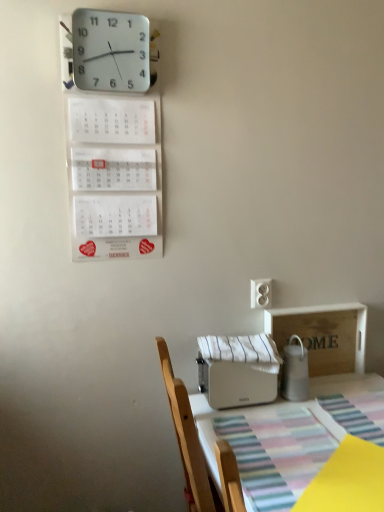
Where is `vacant area that is in front of white plastic toaster at lower center, the second appliance from the right`? The width and height of the screenshot is (384, 512). vacant area that is in front of white plastic toaster at lower center, the second appliance from the right is located at coordinates (258, 435).